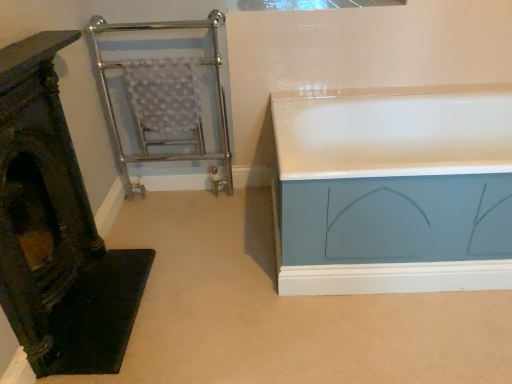
This screenshot has width=512, height=384. In order to click on free space in front of chrome/metal towel rack at left in this screenshot , I will do `click(163, 238)`.